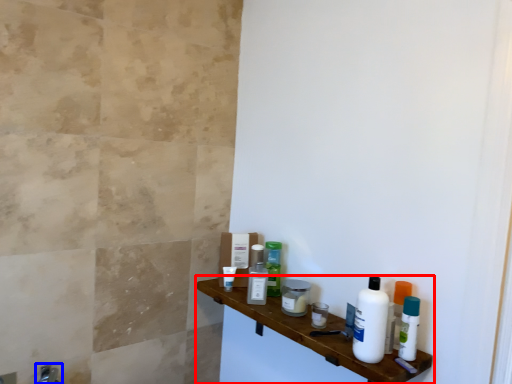
Question: Among these objects, which one is nearest to the camera, shelf (highlighted by a red box) or faucet (highlighted by a blue box)?

Choices:
 (A) shelf
 (B) faucet

Answer: (A)